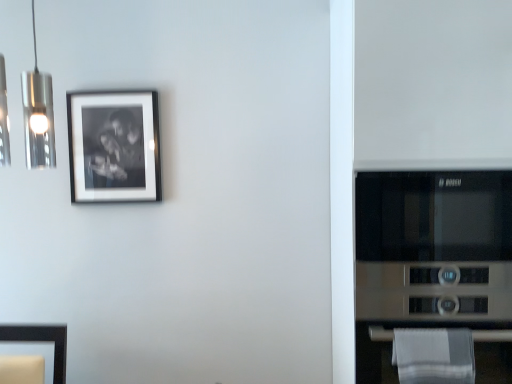
What do you see at coordinates (434, 356) in the screenshot? I see `white cotton towel at lower right` at bounding box center [434, 356].

Where is `stainless steel microwave at right`? stainless steel microwave at right is located at coordinates (433, 276).

The image size is (512, 384). I want to click on matte black frame at upper left, so click(x=114, y=146).

I want to click on white cotton towel at lower right, so click(434, 356).

Between matte black frame at upper left and stainless steel microwave at right, which one has smaller size?

matte black frame at upper left is smaller.

Is matte black frame at upper left not close to stainless steel microwave at right?

That's right, there is a large distance between matte black frame at upper left and stainless steel microwave at right.

How distant is matte black frame at upper left from stainless steel microwave at right?

4.04 feet.

Which is more distant, (x=447, y=190) or (x=116, y=164)?

The point (x=116, y=164) is behind.

How much distance is there between stainless steel microwave at right and matte black frame at upper left?

A distance of 4.04 feet exists between stainless steel microwave at right and matte black frame at upper left.

From a real-world perspective, is stainless steel microwave at right physically located above or below matte black frame at upper left?

In terms of real-world spatial position, stainless steel microwave at right is below matte black frame at upper left.

Find the location of `appliance below the matte black frame at upper left (from the image's perspective)`. appliance below the matte black frame at upper left (from the image's perspective) is located at coordinates click(433, 276).

Which object is thinner, matte black frame at upper left or white cotton towel at lower right?

Thinner between the two is matte black frame at upper left.

Which object is further away from the camera taking this photo, matte black frame at upper left or white cotton towel at lower right?

matte black frame at upper left is more distant.

Considering the relative sizes of matte black frame at upper left and white cotton towel at lower right in the image provided, is matte black frame at upper left smaller than white cotton towel at lower right?

No, matte black frame at upper left is not smaller than white cotton towel at lower right.

This screenshot has width=512, height=384. What are the coordinates of `picture frame lying behind the white cotton towel at lower right` in the screenshot? It's located at (114, 146).

Is white cotton towel at lower right aimed at matte black frame at upper left?

No, white cotton towel at lower right does not turn towards matte black frame at upper left.

Are white cotton towel at lower right and matte black frame at upper left beside each other?

No, white cotton towel at lower right is not in contact with matte black frame at upper left.

Does point (404, 371) lie in front of point (70, 154)?

Yes.

Between white cotton towel at lower right and stainless steel microwave at right, which one has smaller size?

white cotton towel at lower right is smaller.

Looking at their sizes, would you say white cotton towel at lower right is wider or thinner than stainless steel microwave at right?

Considering their sizes, white cotton towel at lower right looks slimmer than stainless steel microwave at right.

Considering the relative positions of white cotton towel at lower right and stainless steel microwave at right in the image provided, is white cotton towel at lower right to the left of stainless steel microwave at right from the viewer's perspective?

Indeed, white cotton towel at lower right is positioned on the left side of stainless steel microwave at right.

Would you say white cotton towel at lower right is inside or outside stainless steel microwave at right?

white cotton towel at lower right is inside stainless steel microwave at right.

Is stainless steel microwave at right next to white cotton towel at lower right and touching it?

No, stainless steel microwave at right is not next to white cotton towel at lower right.

How distant is stainless steel microwave at right from white cotton towel at lower right?

The distance of stainless steel microwave at right from white cotton towel at lower right is 6.47 inches.

Between stainless steel microwave at right and white cotton towel at lower right, which one has larger size?

stainless steel microwave at right is bigger.

Where is `appliance lying below the matte black frame at upper left (from the image's perspective)`? The image size is (512, 384). appliance lying below the matte black frame at upper left (from the image's perspective) is located at coordinates (433, 276).

At what (x,y) coordinates should I click in order to perform the action: click on picture frame behind the stainless steel microwave at right. Please return your answer as a coordinate pair (x, y). Looking at the image, I should click on (114, 146).

Based on the photo, when comparing their distances from matte black frame at upper left, does white cotton towel at lower right or stainless steel microwave at right seem further?

The object further to matte black frame at upper left is white cotton towel at lower right.

From the image, which object appears to be nearer to stainless steel microwave at right, white cotton towel at lower right or matte black frame at upper left?

Based on the image, white cotton towel at lower right appears to be nearer to stainless steel microwave at right.

Looking at the image, which one is located closer to white cotton towel at lower right, matte black frame at upper left or stainless steel microwave at right?

Based on the image, stainless steel microwave at right appears to be nearer to white cotton towel at lower right.

When comparing their distances from matte black frame at upper left, does stainless steel microwave at right or white cotton towel at lower right seem closer?

stainless steel microwave at right is positioned closer to the anchor matte black frame at upper left.

Looking at the image, which one is located further to stainless steel microwave at right, matte black frame at upper left or white cotton towel at lower right?

matte black frame at upper left lies further to stainless steel microwave at right than the other object.

Estimate the real-world distances between objects in this image. Which object is closer to white cotton towel at lower right, stainless steel microwave at right or matte black frame at upper left?

stainless steel microwave at right is positioned closer to the anchor white cotton towel at lower right.

Image resolution: width=512 pixels, height=384 pixels. In order to click on cloth between matte black frame at upper left and stainless steel microwave at right from left to right in this screenshot , I will do `click(434, 356)`.